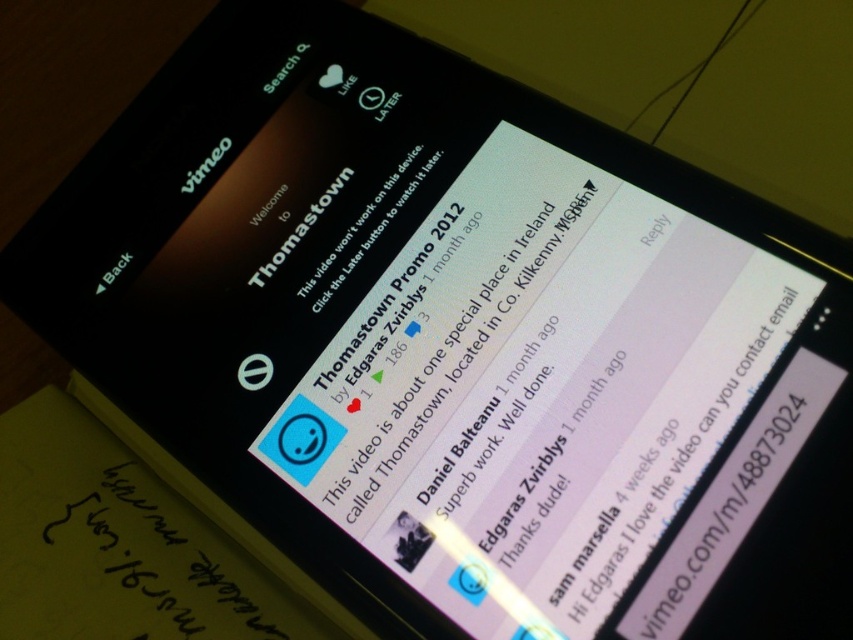
Is white matte text message at center positioned at the back of black paper at bottom left?

That is False.

Does white matte text message at center appear on the left side of black paper at bottom left?

Incorrect, white matte text message at center is not on the left side of black paper at bottom left.

What are the coordinates of `white matte text message at center` in the screenshot? It's located at (535, 390).

This screenshot has width=853, height=640. I want to click on white matte text message at center, so click(535, 390).